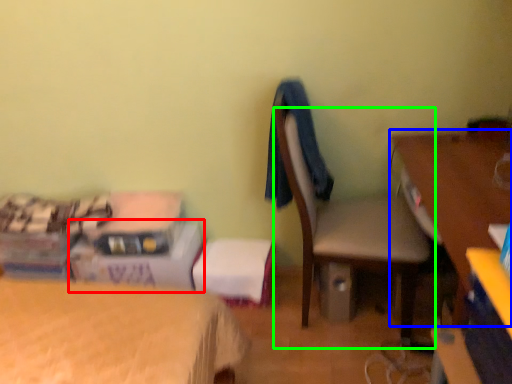
Question: Based on their relative distances, which object is farther from box (highlighted by a red box)? Choose from desk (highlighted by a blue box) and chair (highlighted by a green box).

Choices:
 (A) desk
 (B) chair

Answer: (A)